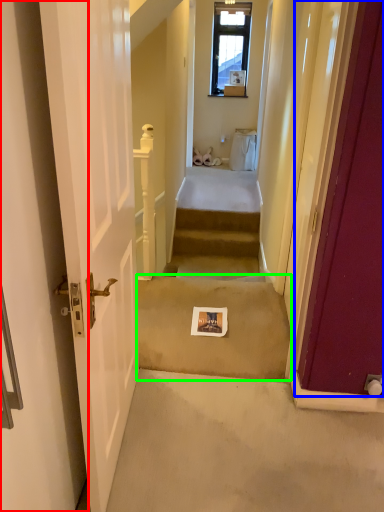
Question: Based on their relative distances, which object is nearer to door (highlighted by a red box)? Choose from door (highlighted by a blue box) and concrete (highlighted by a green box).

Choices:
 (A) door
 (B) concrete

Answer: (A)